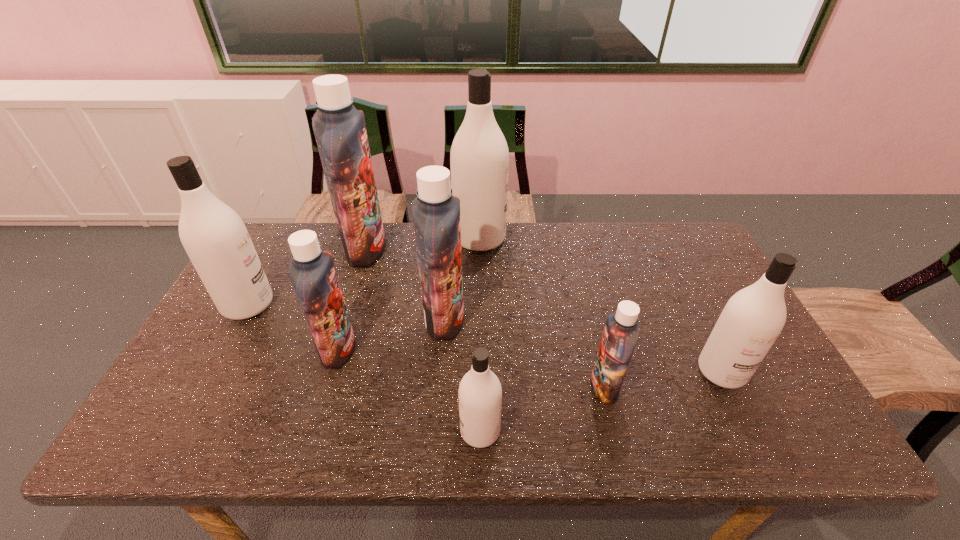
Where is `free point between the biggest white shampoo and the third biggest blue shampoo`? This screenshot has height=540, width=960. free point between the biggest white shampoo and the third biggest blue shampoo is located at coordinates (409, 294).

At what (x,y) coordinates should I click in order to perform the action: click on the fifth closest object to the smallest blue shampoo. Please return your answer as a coordinate pair (x, y). Looking at the image, I should click on (312, 272).

Find the location of `the fifth closest object relative to the second blue shampoo from right to left`. the fifth closest object relative to the second blue shampoo from right to left is located at coordinates click(x=621, y=332).

Select which shampoo appears as the third closest to the leftmost white shampoo. Please provide its 2D coordinates. Your answer should be formatted as a tuple, i.e. [(x, y)], where the tuple contains the x and y coordinates of a point satisfying the conditions above.

[(436, 212)]

Locate which shampoo is the seventh closest to the nearest object. Please provide its 2D coordinates. Your answer should be formatted as a tuple, i.e. [(x, y)], where the tuple contains the x and y coordinates of a point satisfying the conditions above.

[(214, 236)]

This screenshot has height=540, width=960. I want to click on blue shampoo that stands as the closest to the biggest white shampoo, so click(x=436, y=212).

At what (x,y) coordinates should I click in order to perform the action: click on the second closest blue shampoo to the second biggest white shampoo. Please return your answer as a coordinate pair (x, y). Image resolution: width=960 pixels, height=540 pixels. Looking at the image, I should click on (312, 272).

Select which white shampoo appears as the closest to the leftmost object. Please provide its 2D coordinates. Your answer should be formatted as a tuple, i.e. [(x, y)], where the tuple contains the x and y coordinates of a point satisfying the conditions above.

[(479, 159)]

What are the coordinates of `white shampoo that is the closest to the biggest blue shampoo` in the screenshot? It's located at (214, 236).